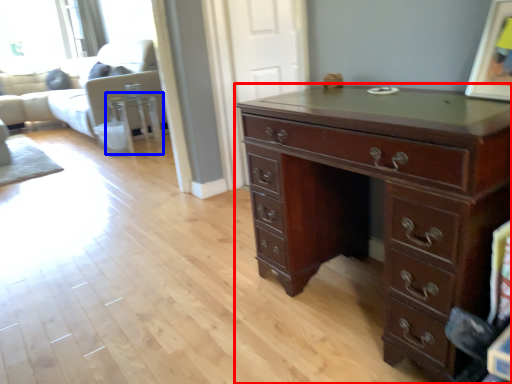
Question: Among these objects, which one is farthest to the camera, chest of drawers (highlighted by a red box) or side table (highlighted by a blue box)?

Choices:
 (A) chest of drawers
 (B) side table

Answer: (B)